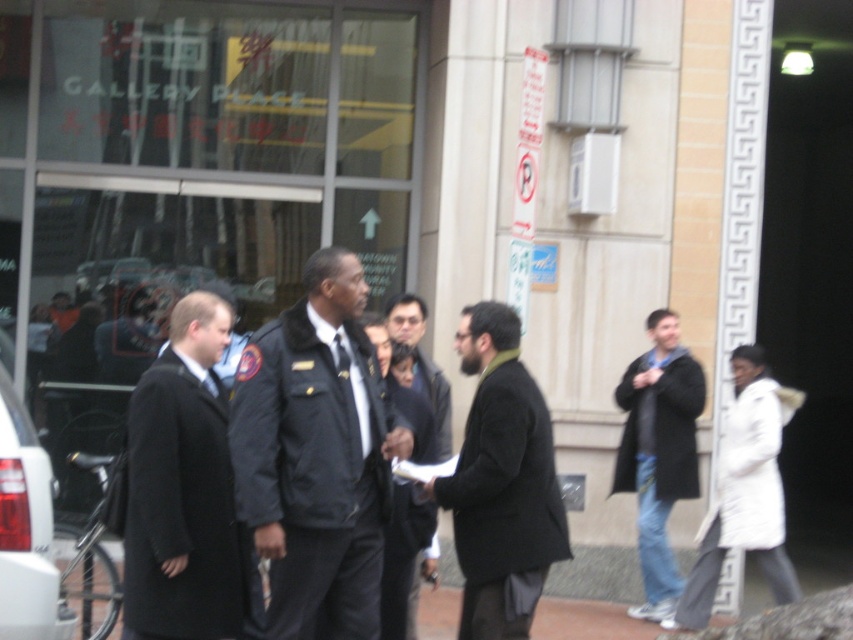
You are a security guard at Gallery Place. You need to determine who to approach first between the dark blue uniform at center and the black wool coat at left based on their sizes. Which person should you approach?

The dark blue uniform at center is bigger than the black wool coat at left, so you should approach the person in the dark blue uniform at center first since they are larger in size.

Looking at this image, you are a photographer trying to capture both the dark blue uniform at center and the matte black car at lower left in a single frame. Considering their sizes, which object should you focus on to ensure both are clearly visible in the photo?

The dark blue uniform at center is larger than the matte black car at lower left, so focusing on the dark blue uniform at center would help ensure both objects are clearly visible in the photo.

Based on the scene at Gallery Place, where is the dark blue uniform at center located in relation to the matte black car at lower left?

The dark blue uniform at center is to the right of the matte black car at lower left.